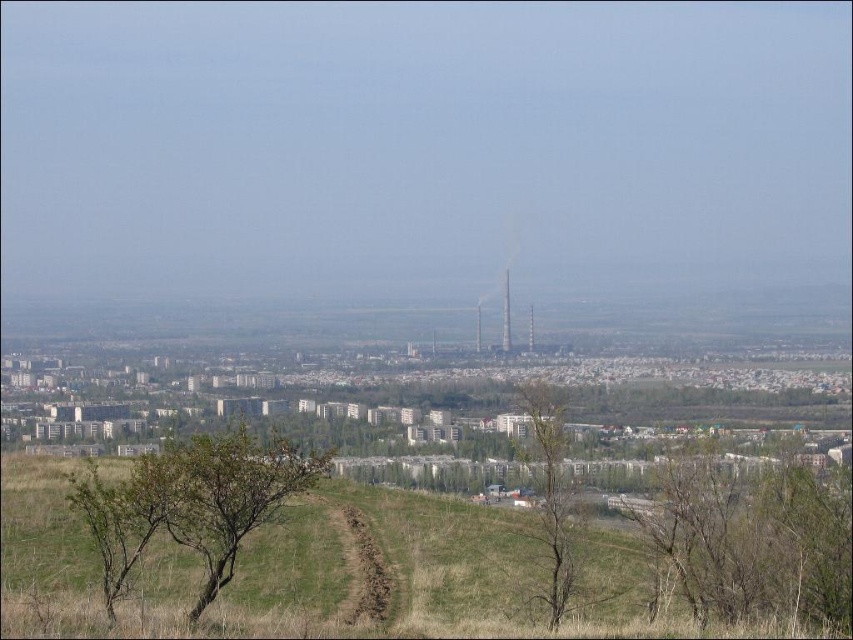
Looking at this image, does brown leafless tree at lower right come behind green leafy tree at center?

No, brown leafless tree at lower right is closer to the viewer.

Describe the element at coordinates (751, 538) in the screenshot. I see `brown leafless tree at lower right` at that location.

You are a GUI agent. You are given a task and a screenshot of the screen. Output one action in this format:
    pyautogui.click(x=<x>, y=<y>)
    Task: Click on the brown leafless tree at lower right
    This screenshot has height=640, width=853.
    Given the screenshot: What is the action you would take?
    pyautogui.click(x=751, y=538)

Find the location of `brown leafless tree at lower right`. brown leafless tree at lower right is located at coordinates (751, 538).

Between green leafy tree at left and green leafy tree at center, which one appears on the left side from the viewer's perspective?

From the viewer's perspective, green leafy tree at left appears more on the left side.

Is green leafy tree at left below green leafy tree at center?

Incorrect, green leafy tree at left is not positioned below green leafy tree at center.

Which is in front, point (238, 529) or point (560, 403)?

Point (238, 529) is more forward.

This screenshot has width=853, height=640. I want to click on green leafy tree at left, so click(192, 502).

From the picture: Is brown leafless tree at lower right positioned behind green leafy tree at left?

Yes, it is.

Locate an element on the screen. brown leafless tree at lower right is located at coordinates (751, 538).